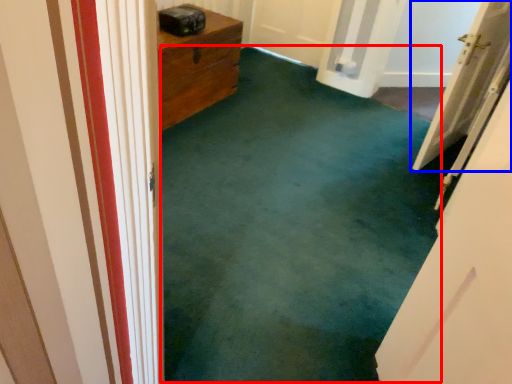
Question: Which object is further to the camera taking this photo, corridor (highlighted by a red box) or door (highlighted by a blue box)?

Choices:
 (A) corridor
 (B) door

Answer: (B)